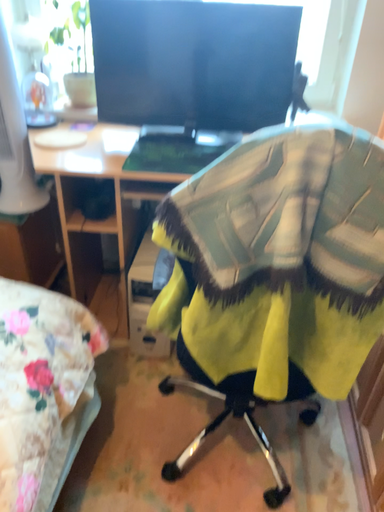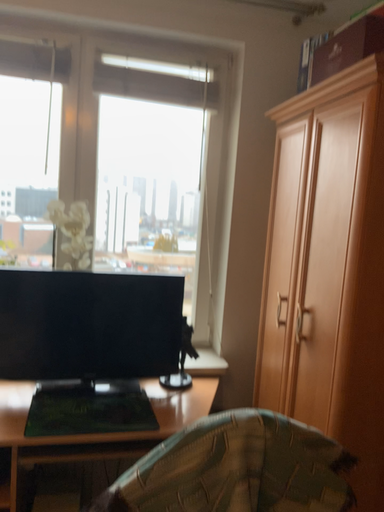
Question: How did the camera likely rotate when shooting the video?

Choices:
 (A) rotated downward
 (B) rotated upward

Answer: (B)